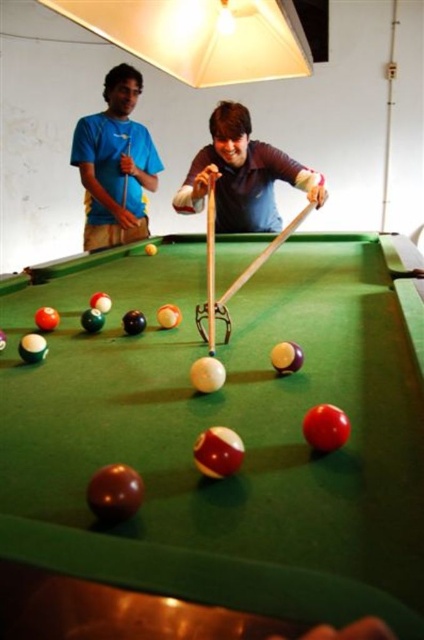
Is wooden cue at center wider than matte wood cue at center?

Correct, the width of wooden cue at center exceeds that of matte wood cue at center.

Between wooden cue at center and matte wood cue at center, which one has more height?

matte wood cue at center is taller.

Is point (236, 282) positioned behind point (130, 145)?

No, (236, 282) is closer to viewer.

This screenshot has height=640, width=424. Find the location of `wooden cue at center`. wooden cue at center is located at coordinates (264, 257).

Between green felt billiard table at center and matte brown shirt at center, which one has less height?

With less height is green felt billiard table at center.

How far apart are green felt billiard table at center and matte brown shirt at center?

green felt billiard table at center is 3.30 feet away from matte brown shirt at center.

Does point (72, 563) come in front of point (219, 196)?

Yes, it is.

The height and width of the screenshot is (640, 424). I want to click on green felt billiard table at center, so click(x=233, y=428).

Can you confirm if matte blue shirt at upper left is taller than wooden cue at center?

Indeed, matte blue shirt at upper left has a greater height compared to wooden cue at center.

What do you see at coordinates (114, 163) in the screenshot? I see `matte blue shirt at upper left` at bounding box center [114, 163].

Find the location of a particular element. matte blue shirt at upper left is located at coordinates tap(114, 163).